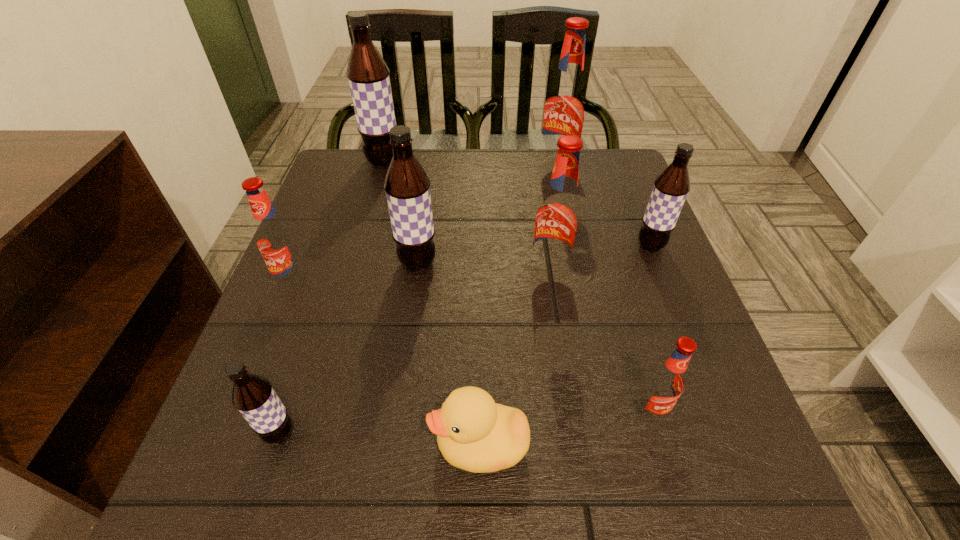
Find the location of `vacant area situated on the right of the nearest brown root beer`. vacant area situated on the right of the nearest brown root beer is located at coordinates (376, 434).

The image size is (960, 540). I want to click on vacant position located at the beak of the duck, so click(x=378, y=445).

This screenshot has height=540, width=960. In order to click on blank space located at the beak of the duck in this screenshot , I will do `click(291, 445)`.

In order to click on blank space located 0.170m at the beak of the duck in this screenshot , I will do `click(318, 445)`.

You are a GUI agent. You are given a task and a screenshot of the screen. Output one action in this format:
    pyautogui.click(x=<x>, y=<y>)
    Task: Click on the object that is at the near edge
    
    Given the screenshot: What is the action you would take?
    pyautogui.click(x=474, y=433)

This screenshot has height=540, width=960. What are the coordinates of `object present at the far left corner` in the screenshot? It's located at (368, 75).

The width and height of the screenshot is (960, 540). What are the coordinates of `object that is at the far right corner` in the screenshot? It's located at (565, 107).

The image size is (960, 540). What are the coordinates of `free space at the far edge` in the screenshot? It's located at (455, 148).

In the image, there is a desktop. Find the location of `blank space at the near edge`. blank space at the near edge is located at coordinates (323, 521).

The image size is (960, 540). What are the coordinates of `free space at the left edge` in the screenshot? It's located at (327, 239).